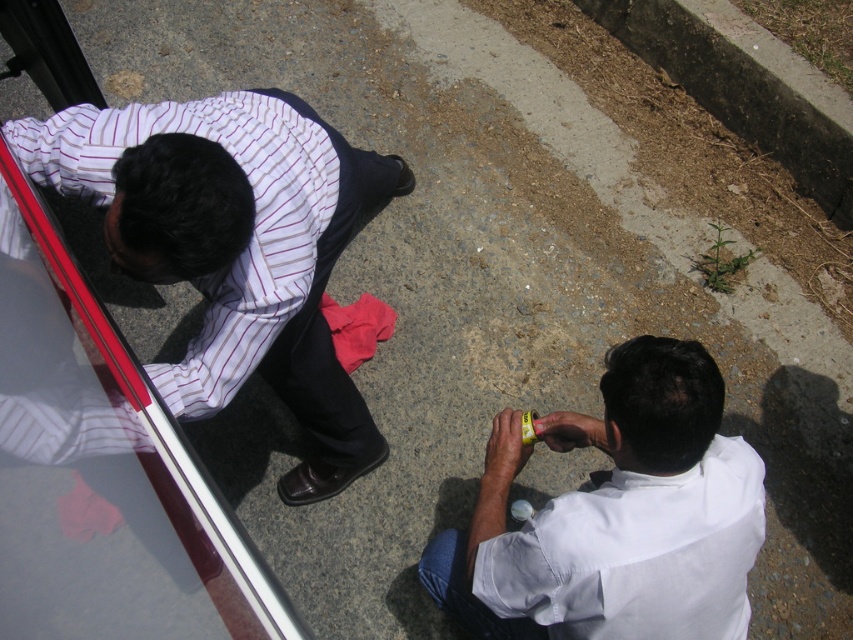
Does striped cotton shirt at left have a greater width compared to white matte shirt at lower right?

Indeed, striped cotton shirt at left has a greater width compared to white matte shirt at lower right.

This screenshot has height=640, width=853. Identify the location of striped cotton shirt at left. point(234,248).